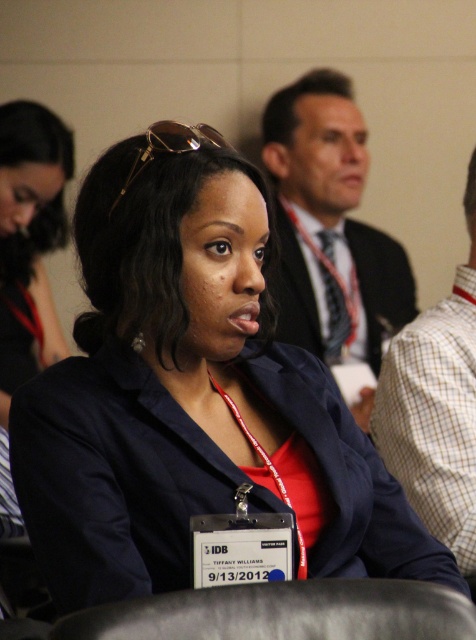
You are organizing a formal event and need to ensure all jackets fit in the coatroom. The coatroom has two hangers, one for larger jackets and one for smaller ones. Given the dark suit jacket at upper center and the matte black jacket at center, which jacket should go on the larger hanger?

The dark suit jacket at upper center should go on the larger hanger because its width is larger than the matte black jacket at center.

Based on the photo, you are organizing a photo shoot and need to ensure proper spacing between two jackets displayed in the image. The dark suit jacket at upper center and the matte black jacket at center must be spaced exactly 30 inches apart for the shoot. Based on the provided information, will the current spacing between them meet the requirement?

The dark suit jacket at upper center is 30.41 inches from the matte black jacket at center, which is slightly more than the required 30 inches. The spacing is acceptable as it meets the requirement.